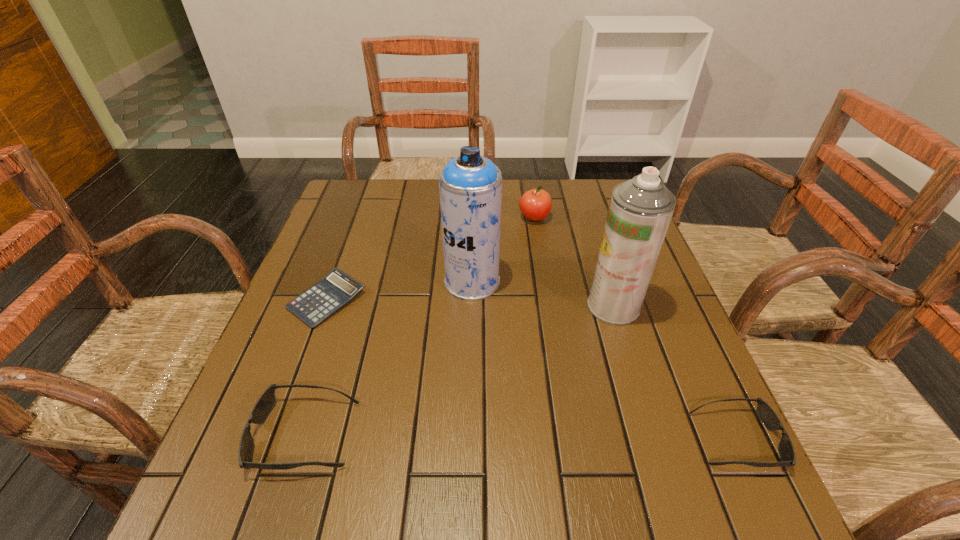
At what (x,y) coordinates should I click in order to perform the action: click on vacant space at the far edge of the desktop. Please return your answer as a coordinate pair (x, y). Looking at the image, I should click on (440, 198).

This screenshot has width=960, height=540. In order to click on free region at the near edge of the desktop in this screenshot , I will do `click(570, 438)`.

In the image, there is a desktop. At what (x,y) coordinates should I click in order to perform the action: click on vacant space at the left edge. Please return your answer as a coordinate pair (x, y). Looking at the image, I should click on (295, 298).

This screenshot has width=960, height=540. In the image, there is a desktop. What are the coordinates of `free space at the right edge` in the screenshot? It's located at (650, 309).

This screenshot has width=960, height=540. What are the coordinates of `vacant space at the far right corner` in the screenshot? It's located at (594, 193).

This screenshot has height=540, width=960. I want to click on vacant area at the near right corner, so click(x=638, y=418).

Identify the location of empty space between the right aerosol can and the right sunglasses. (675, 373).

Identify the location of free space between the left aerosol can and the right sunglasses. Image resolution: width=960 pixels, height=540 pixels. [x=605, y=360].

Identify the location of free space between the right aerosol can and the third tallest object. The height and width of the screenshot is (540, 960). (574, 262).

I want to click on vacant point located between the left aerosol can and the right sunglasses, so click(605, 360).